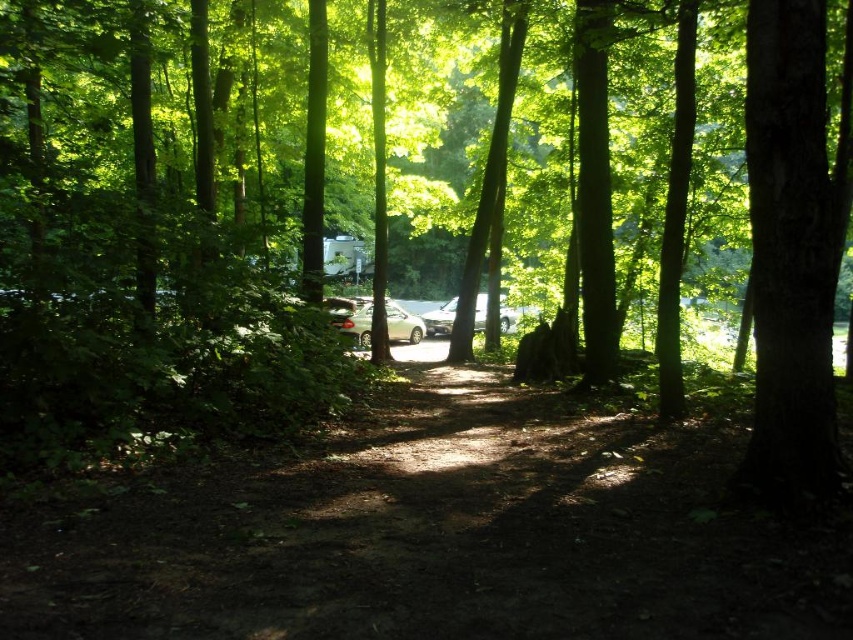
Can you confirm if silver metallic car at center is taller than metallic silver car at center?

Yes.

What do you see at coordinates (354, 320) in the screenshot?
I see `silver metallic car at center` at bounding box center [354, 320].

Where is `silver metallic car at center`? silver metallic car at center is located at coordinates (354, 320).

Locate an element on the screen. The image size is (853, 640). dirt path at center is located at coordinates (439, 536).

The width and height of the screenshot is (853, 640). I want to click on dirt path at center, so click(x=439, y=536).

You are a GUI agent. You are given a task and a screenshot of the screen. Output one action in this format:
    pyautogui.click(x=<x>, y=<y>)
    Task: Click on the dirt path at center
    The width and height of the screenshot is (853, 640).
    Given the screenshot: What is the action you would take?
    pyautogui.click(x=439, y=536)

Does point (762, 428) come behind point (355, 310)?

That is False.

Does smooth bark tree at right have a greater height compared to silver metallic car at center?

Yes, smooth bark tree at right is taller than silver metallic car at center.

Which is behind, point (798, 380) or point (339, 323)?

Point (339, 323)

In order to click on smooth bark tree at right in this screenshot , I will do pos(792,252).